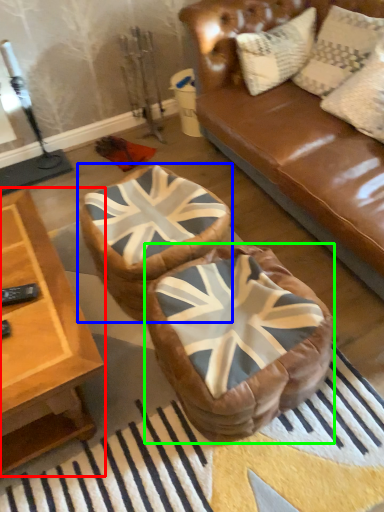
Question: Which is farther away from table (highlighted by a red box)? bean bag chair (highlighted by a blue box) or bean bag chair (highlighted by a green box)?

Choices:
 (A) bean bag chair
 (B) bean bag chair

Answer: (B)